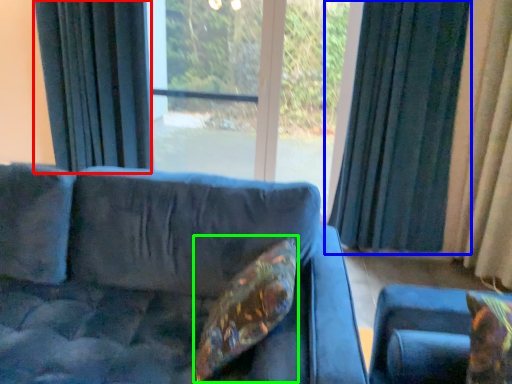
Question: Based on their relative distances, which object is farther from curtain (highlighted by a red box)? Choose from curtain (highlighted by a blue box) and pillow (highlighted by a green box).

Choices:
 (A) curtain
 (B) pillow

Answer: (B)